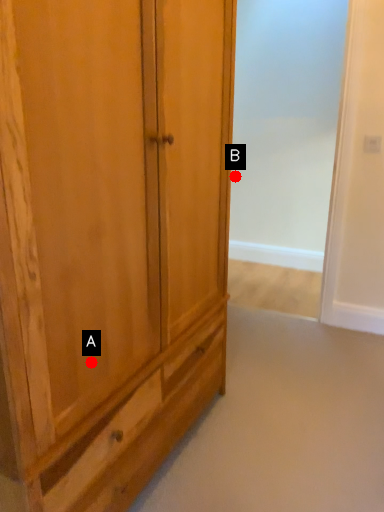
Question: Two points are circled on the image, labeled by A and B beside each circle. Among these points, which one is farthest from the camera?

Choices:
 (A) A is further
 (B) B is further

Answer: (B)